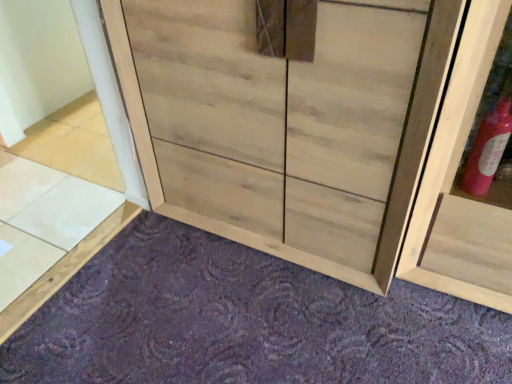
Question: Considering the relative sizes of natural wood cupboard at center and light brown wood tile at lower left in the image provided, is natural wood cupboard at center shorter than light brown wood tile at lower left?

Choices:
 (A) yes
 (B) no

Answer: (B)

Question: Considering the relative sizes of natural wood cupboard at center and light brown wood tile at lower left in the image provided, is natural wood cupboard at center bigger than light brown wood tile at lower left?

Choices:
 (A) yes
 (B) no

Answer: (A)

Question: Would you say natural wood cupboard at center is outside light brown wood tile at lower left?

Choices:
 (A) no
 (B) yes

Answer: (B)

Question: Can you confirm if natural wood cupboard at center is positioned to the left of light brown wood tile at lower left?

Choices:
 (A) no
 (B) yes

Answer: (A)

Question: Is natural wood cupboard at center taller than light brown wood tile at lower left?

Choices:
 (A) yes
 (B) no

Answer: (A)

Question: In the image, is light brown wood tile at lower left positioned in front of or behind natural wood cupboard at center?

Choices:
 (A) front
 (B) behind

Answer: (B)

Question: Considering the positions of point (83, 152) and point (145, 51), is point (83, 152) closer or farther from the camera than point (145, 51)?

Choices:
 (A) closer
 (B) farther

Answer: (B)

Question: Visually, is light brown wood tile at lower left positioned to the left or to the right of natural wood cupboard at center?

Choices:
 (A) right
 (B) left

Answer: (B)

Question: Considering the positions of light brown wood tile at lower left and natural wood cupboard at center in the image, is light brown wood tile at lower left taller or shorter than natural wood cupboard at center?

Choices:
 (A) tall
 (B) short

Answer: (B)

Question: Considering the positions of natural wood cupboard at center and light brown wood tile at lower left in the image, is natural wood cupboard at center taller or shorter than light brown wood tile at lower left?

Choices:
 (A) short
 (B) tall

Answer: (B)

Question: From a real-world perspective, is natural wood cupboard at center above or below light brown wood tile at lower left?

Choices:
 (A) above
 (B) below

Answer: (A)

Question: From the image's perspective, relative to light brown wood tile at lower left, is natural wood cupboard at center above or below?

Choices:
 (A) below
 (B) above

Answer: (B)

Question: In terms of size, does natural wood cupboard at center appear bigger or smaller than light brown wood tile at lower left?

Choices:
 (A) big
 (B) small

Answer: (A)

Question: Is point (84, 167) closer or farther from the camera than point (19, 337)?

Choices:
 (A) closer
 (B) farther

Answer: (B)

Question: In the image, is light brown wood tile at lower left positioned in front of or behind purple carpet at lower center?

Choices:
 (A) front
 (B) behind

Answer: (B)